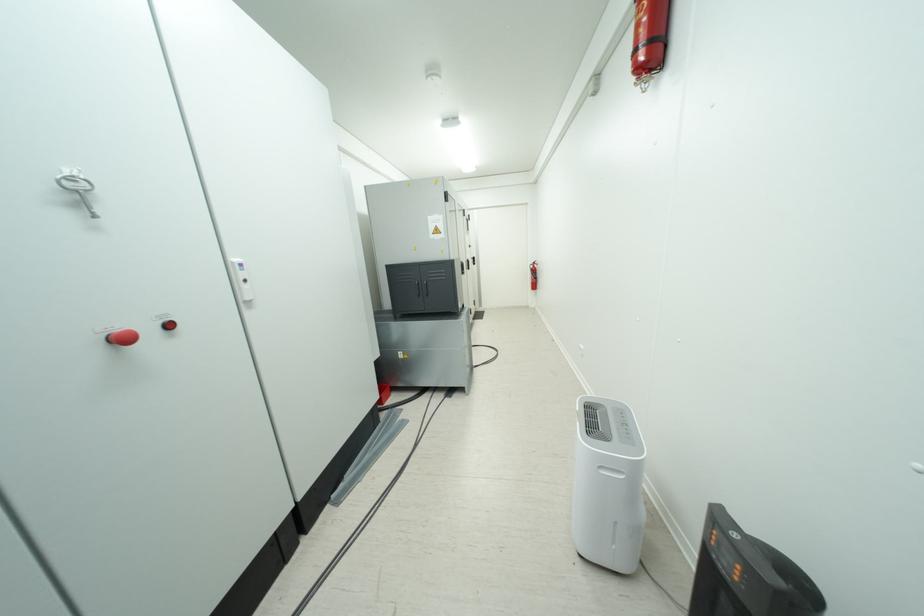
Find where to pull the fire extinguisher handle. Please return your answer as a coordinate pair (x, y).

(532, 275)